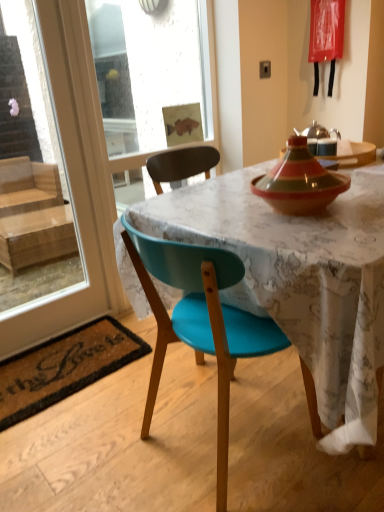
At what (x,y) coordinates should I click in order to perform the action: click on blank area to the left of teal plastic chair at center. Please return your answer as a coordinate pair (x, y). Looking at the image, I should click on (99, 444).